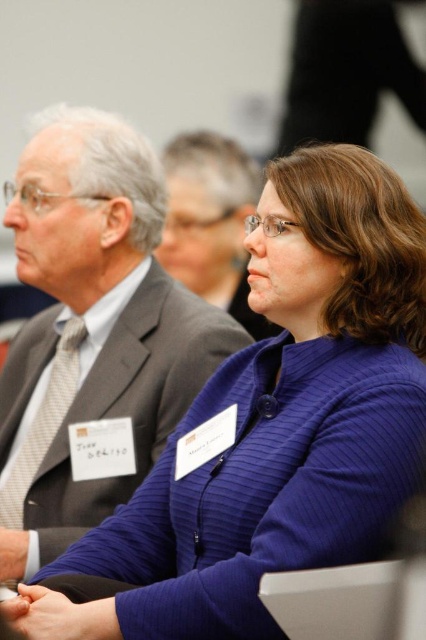
Who is higher up, gray suit at center or matte gray suit at center?

Positioned higher is matte gray suit at center.

Does gray suit at center have a greater height compared to matte gray suit at center?

Indeed, gray suit at center has a greater height compared to matte gray suit at center.

What do you see at coordinates (92, 328) in the screenshot? I see `gray suit at center` at bounding box center [92, 328].

Where is `gray suit at center`? The width and height of the screenshot is (426, 640). gray suit at center is located at coordinates (92, 328).